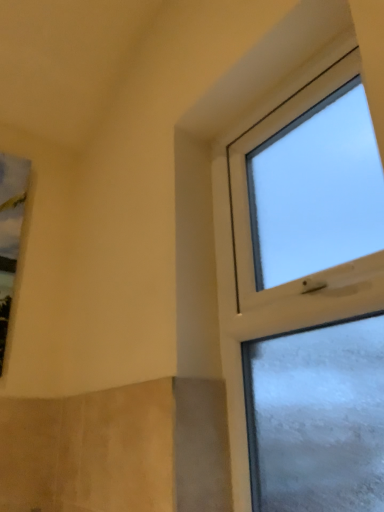
The width and height of the screenshot is (384, 512). What do you see at coordinates (308, 302) in the screenshot? I see `clear glass window at upper right` at bounding box center [308, 302].

Where is `clear glass window at upper right`? This screenshot has height=512, width=384. clear glass window at upper right is located at coordinates (308, 302).

What is the approximate width of clear glass window at upper right?

clear glass window at upper right is 3.75 inches wide.

Where is `clear glass window at upper right`? clear glass window at upper right is located at coordinates point(308,302).